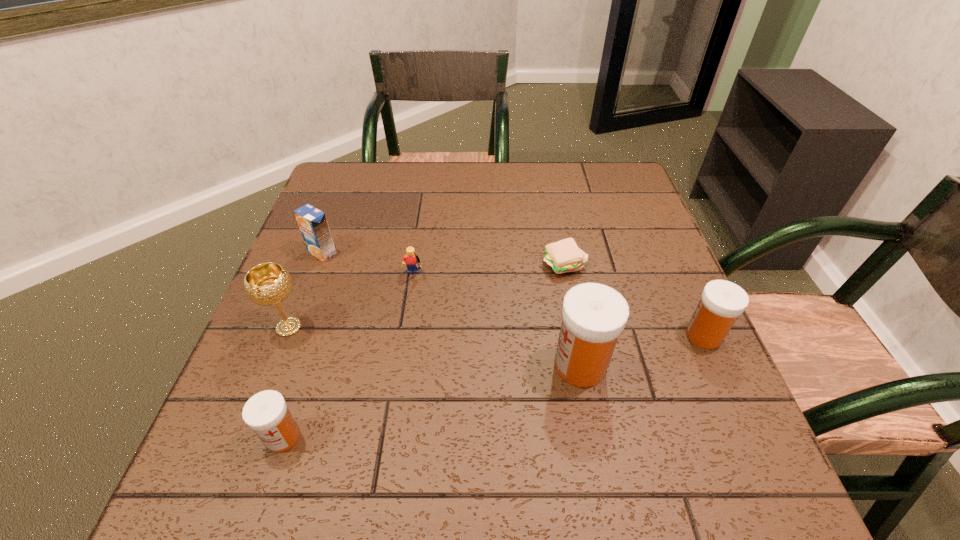
You are a GUI agent. You are given a task and a screenshot of the screen. Output one action in this format:
    pyautogui.click(x=<x>, y=<y>)
    Task: Click on the object that is positioned at the right edge
    
    Given the screenshot: What is the action you would take?
    pyautogui.click(x=721, y=303)

What are the coordinates of `object that is at the near left corner` in the screenshot? It's located at (266, 413).

In the image, there is a desktop. What are the coordinates of `vacant space at the far edge` in the screenshot? It's located at (495, 183).

This screenshot has height=540, width=960. I want to click on vacant space at the near edge of the desktop, so click(x=469, y=420).

Locate an element on the screen. free space at the left edge of the desktop is located at coordinates (x=331, y=228).

In order to click on free space at the right edge of the desktop in this screenshot , I will do `click(662, 309)`.

Where is `free space at the far left corner`? The image size is (960, 540). free space at the far left corner is located at coordinates (374, 177).

At what (x,y) coordinates should I click in order to perform the action: click on free space between the nearest object and the patty. Please return your answer as a coordinate pair (x, y). This screenshot has height=540, width=960. Looking at the image, I should click on (423, 351).

Where is `vacant area that lies between the fourth object from right to left and the leftmost medicine`? The height and width of the screenshot is (540, 960). vacant area that lies between the fourth object from right to left and the leftmost medicine is located at coordinates (348, 357).

Find the location of `empty location between the rightmost medicine and the chalice`. empty location between the rightmost medicine and the chalice is located at coordinates (496, 331).